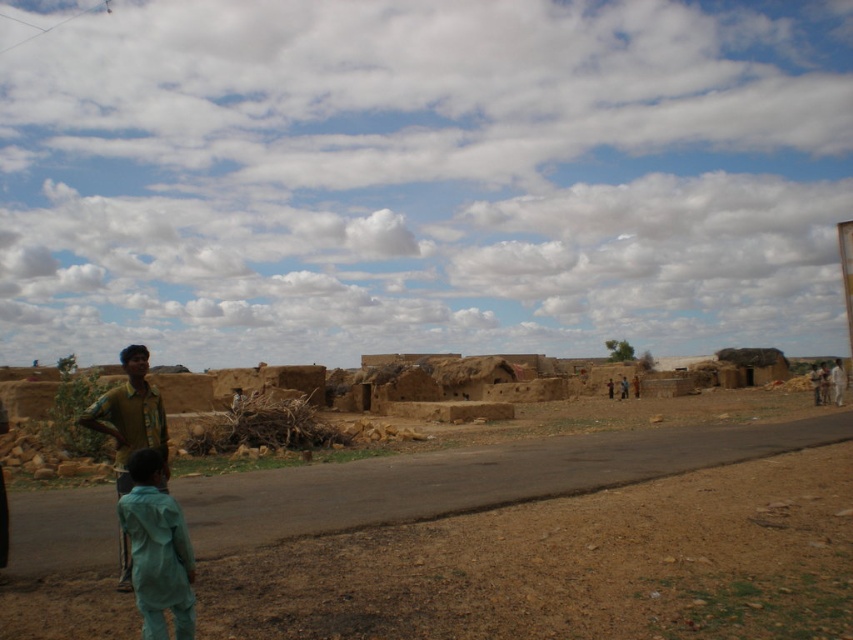
Is brown dirt field at lower center taller than teal fabric child at lower left?

No.

Can you confirm if brown dirt field at lower center is positioned above teal fabric child at lower left?

Incorrect, brown dirt field at lower center is not positioned above teal fabric child at lower left.

Locate an element on the screen. brown dirt field at lower center is located at coordinates click(572, 564).

Locate an element on the screen. The height and width of the screenshot is (640, 853). brown dirt field at lower center is located at coordinates (572, 564).

Is point (701, 566) more distant than point (157, 408)?

No, it is not.

Which is above, brown dirt field at lower center or yellow-green fabric shirt at left?

yellow-green fabric shirt at left is higher up.

Locate an element on the screen. Image resolution: width=853 pixels, height=640 pixels. brown dirt field at lower center is located at coordinates (572, 564).

Is teal fabric child at lower left closer to camera compared to yellow-green fabric shirt at left?

Yes, it is in front of yellow-green fabric shirt at left.

Find the location of a particular element. teal fabric child at lower left is located at coordinates (157, 550).